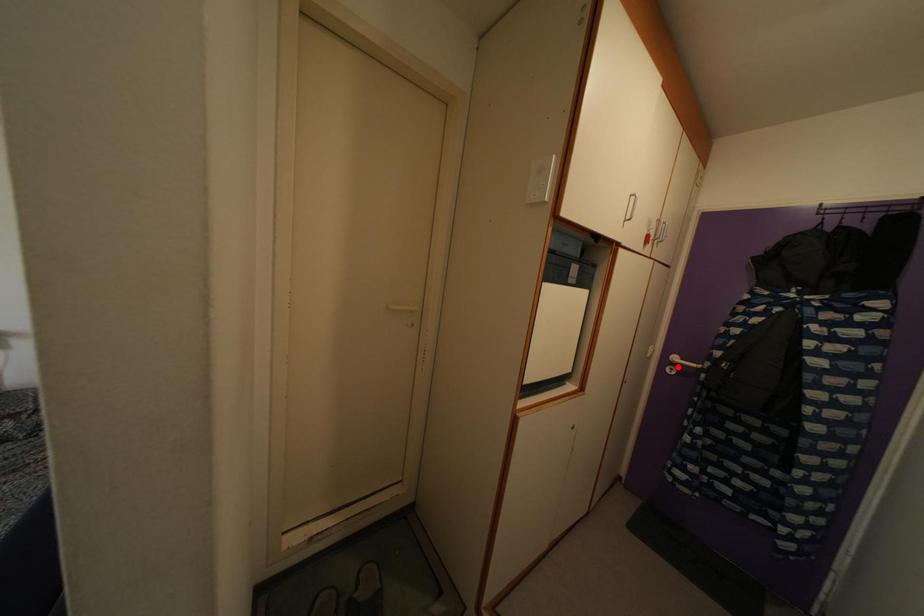
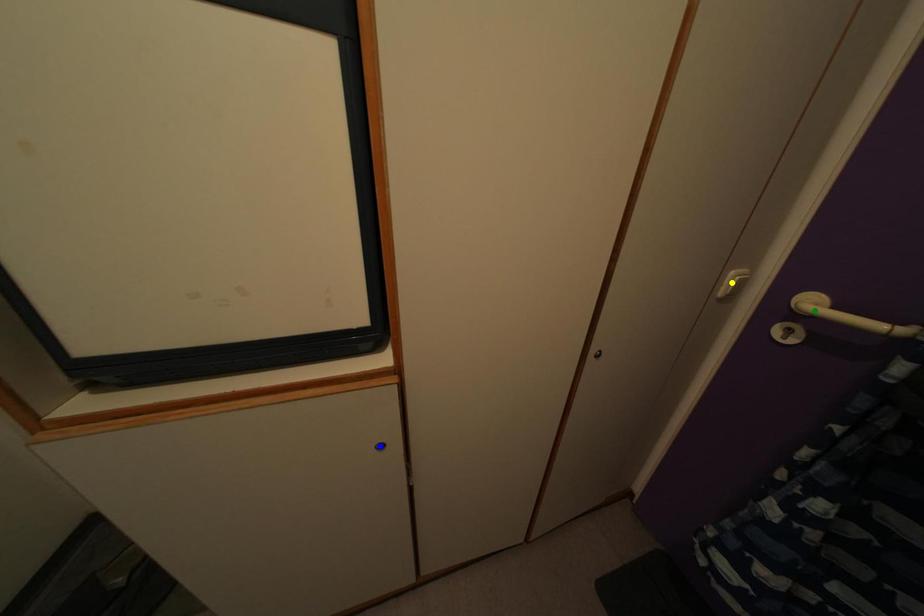
Question: I am providing you with two images of the same scene from different viewpoints. A red point is marked on the first image. You are given multiple points on the second image. In image 2, which mark is for the same physical point as the one in image 1?

Choices:
 (A) yellow point
 (B) blue point
 (C) green point

Answer: (C)